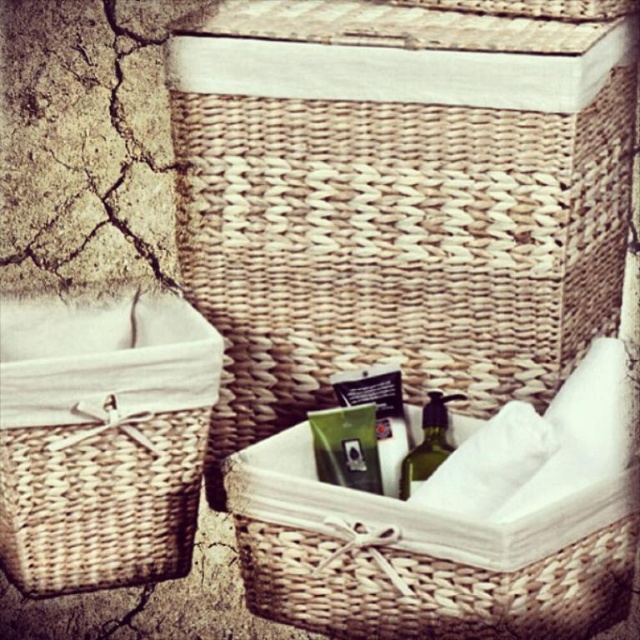
You are standing in front of three woven baskets against a wall. You need to place a new item into the woven natural picnic basket at upper center. Based on its position, can you confirm if this basket is the one furthest to the back or the middle one?

The woven natural picnic basket at upper center is located at point (397, 198), which places it in the middle position among the three baskets, so it is the middle one.

Where is the woven beige basket at center located in the image?

The woven beige basket at center is located at point (422, 556).

You are a delivery person who needs to place a new package that is 15 centimeters long between the woven beige basket at center and the green matte bottle at center. Based on the scene, will the package fit in the space between them?

The distance between the woven beige basket at center and the green matte bottle at center is 14.01 centimeters. Since the package is 15 centimeters long, it will not fit in the space between them as the package is longer than the available space.